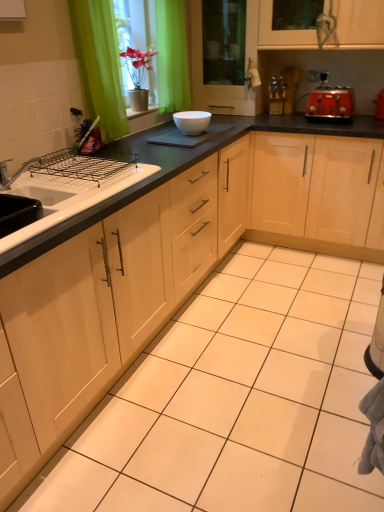
Question: Does white glossy bowl at center have a greater height compared to light wood cabinet at center, which ranks as the 1th cabinetry in right-to-left order?

Choices:
 (A) no
 (B) yes

Answer: (A)

Question: Are white glossy bowl at center and light wood cabinet at center, which ranks as the 1th cabinetry in right-to-left order, far apart?

Choices:
 (A) yes
 (B) no

Answer: (B)

Question: Is white glossy bowl at center bigger than light wood cabinet at center, which appears as the second cabinetry when viewed from the left?

Choices:
 (A) yes
 (B) no

Answer: (B)

Question: From a real-world perspective, is white glossy bowl at center physically below light wood cabinet at center, which ranks as the 1th cabinetry in right-to-left order?

Choices:
 (A) yes
 (B) no

Answer: (B)

Question: From a real-world perspective, is white glossy bowl at center over light wood cabinet at center, which ranks as the 1th cabinetry in right-to-left order?

Choices:
 (A) no
 (B) yes

Answer: (B)

Question: Would you say white glossy sink at left is to the left or to the right of white glossy bowl at center in the picture?

Choices:
 (A) right
 (B) left

Answer: (B)

Question: From the image's perspective, is white glossy sink at left located above or below white glossy bowl at center?

Choices:
 (A) above
 (B) below

Answer: (B)

Question: In terms of size, does white glossy sink at left appear bigger or smaller than white glossy bowl at center?

Choices:
 (A) big
 (B) small

Answer: (A)

Question: From a real-world perspective, relative to white glossy bowl at center, is white glossy sink at left vertically above or below?

Choices:
 (A) below
 (B) above

Answer: (A)

Question: From the image's perspective, relative to white glossy sink at left, is red matte toaster at upper right above or below?

Choices:
 (A) below
 (B) above

Answer: (B)

Question: Relative to white glossy sink at left, is red matte toaster at upper right in front or behind?

Choices:
 (A) behind
 (B) front

Answer: (A)

Question: Is red matte toaster at upper right situated inside white glossy sink at left or outside?

Choices:
 (A) inside
 (B) outside

Answer: (B)

Question: In terms of width, does red matte toaster at upper right look wider or thinner when compared to white glossy sink at left?

Choices:
 (A) thin
 (B) wide

Answer: (A)

Question: From the image's perspective, is matte wood cabinet at center, which appears as the 2th cabinetry when viewed from the right, positioned above or below green fabric curtain at upper left?

Choices:
 (A) above
 (B) below

Answer: (B)

Question: Is matte wood cabinet at center, which appears as the 2th cabinetry when viewed from the right, spatially inside green fabric curtain at upper left, or outside of it?

Choices:
 (A) outside
 (B) inside

Answer: (A)